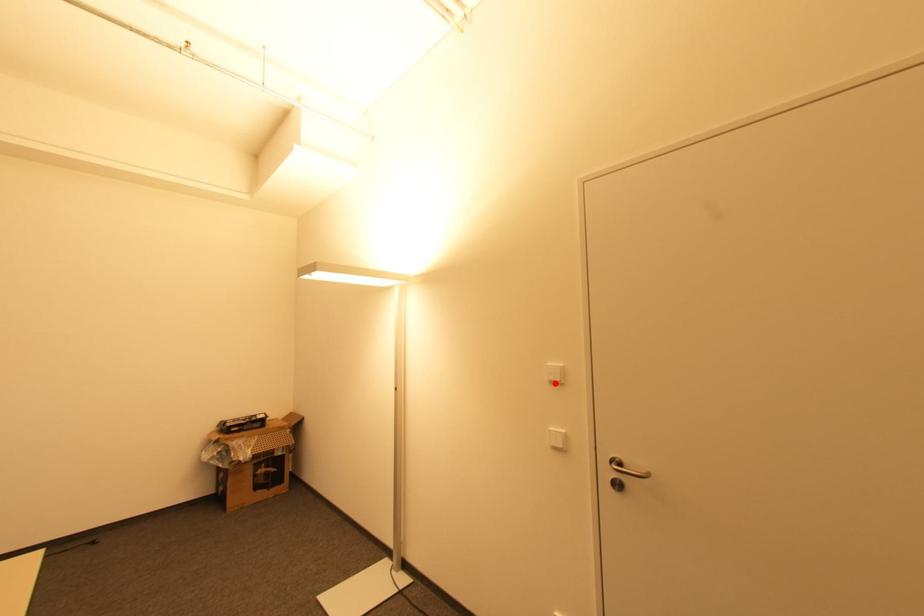
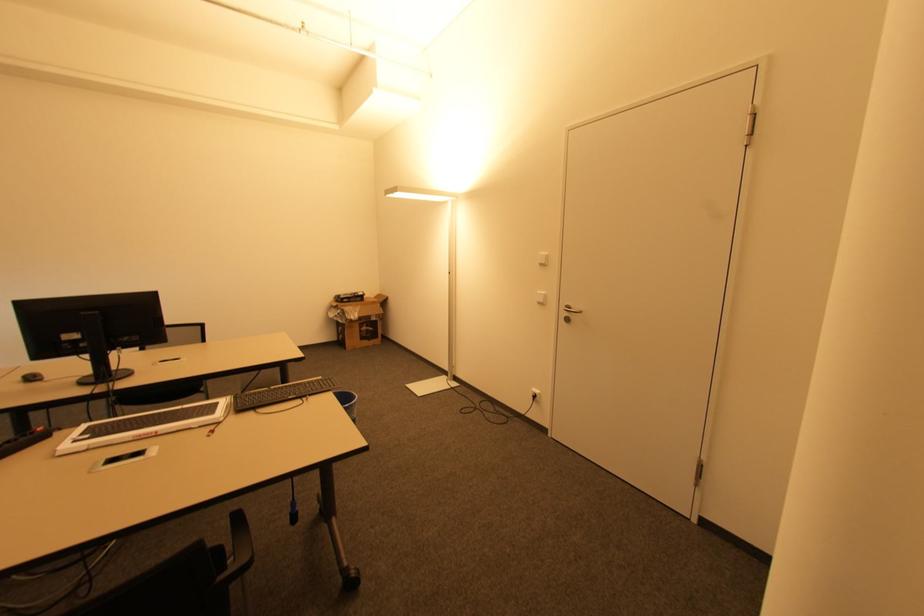
Where in the second image is the point corresponding to the highlighted location from the first image?

(542, 265)